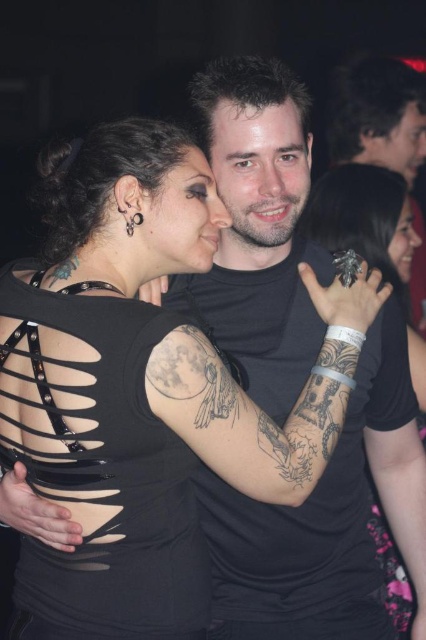
Looking at this image, you are a photographer at a party and notice two items in your viewfinder. You see the black matte ring at upper right and the matte black face at center. Which object is positioned lower in the frame?

The black matte ring at upper right is positioned below the matte black face at center, so it is lower in the frame.

In the dimly lit social setting, there are two faces visible. The first is a matte black face at center, and the second is a smooth skin face at upper right. Which face appears smaller in height?

The matte black face at center is not as tall as the smooth skin face at upper right, so the matte black face at center appears smaller in height.